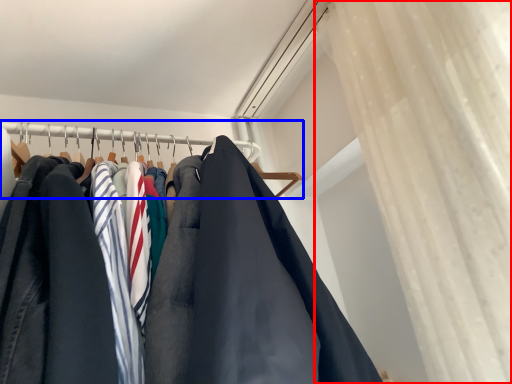
Question: Which object is closer to the camera taking this photo, curtain (highlighted by a red box) or closet (highlighted by a blue box)?

Choices:
 (A) curtain
 (B) closet

Answer: (A)